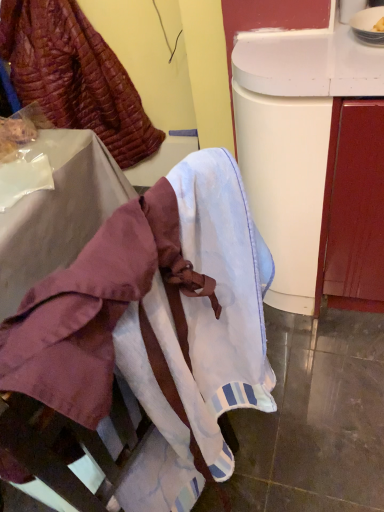
The image size is (384, 512). What do you see at coordinates (75, 76) in the screenshot?
I see `velvet-like burgundy fabric at upper left` at bounding box center [75, 76].

Find the location of a particular element. This screenshot has height=512, width=384. velvet-like burgundy fabric at upper left is located at coordinates (75, 76).

Measure the distance between velvet-like burgundy fabric at upper left and camera.

The distance of velvet-like burgundy fabric at upper left from camera is 5.47 feet.

This screenshot has width=384, height=512. Describe the element at coordinates (157, 319) in the screenshot. I see `white cotton towel at lower center` at that location.

Locate an element on the screen. Image resolution: width=384 pixels, height=512 pixels. white cotton towel at lower center is located at coordinates (157, 319).

What is the approximate width of white cotton towel at lower center?

The width of white cotton towel at lower center is 10.42 inches.

The height and width of the screenshot is (512, 384). What are the coordinates of `velvet-like burgundy fabric at upper left` in the screenshot? It's located at (75, 76).

Is velvet-like burgundy fabric at upper left to the right of white cotton towel at lower center from the viewer's perspective?

No.

Is velvet-like burgundy fabric at upper left in front of or behind white cotton towel at lower center in the image?

Visually, velvet-like burgundy fabric at upper left is located behind white cotton towel at lower center.

Which is nearer, (148, 125) or (236, 310)?

Point (148, 125).

From the image's perspective, who appears lower, velvet-like burgundy fabric at upper left or white cotton towel at lower center?

white cotton towel at lower center, from the image's perspective.

From a real-world perspective, is velvet-like burgundy fabric at upper left below white cotton towel at lower center?

Yes, from a real-world perspective, velvet-like burgundy fabric at upper left is under white cotton towel at lower center.

Between velvet-like burgundy fabric at upper left and white cotton towel at lower center, which one has smaller width?

white cotton towel at lower center.

Which of these two, velvet-like burgundy fabric at upper left or white cotton towel at lower center, stands taller?

velvet-like burgundy fabric at upper left is taller.

Which of these two, velvet-like burgundy fabric at upper left or white cotton towel at lower center, is smaller?

Smaller between the two is white cotton towel at lower center.

Is white cotton towel at lower center a part of velvet-like burgundy fabric at upper left?

No, white cotton towel at lower center is located outside of velvet-like burgundy fabric at upper left.

Are velvet-like burgundy fabric at upper left and white cotton towel at lower center located far from each other?

Yes.

Is velvet-like burgundy fabric at upper left facing away from white cotton towel at lower center?

No, velvet-like burgundy fabric at upper left is not facing away from white cotton towel at lower center.

How different are the orientations of velvet-like burgundy fabric at upper left and white cotton towel at lower center in degrees?

velvet-like burgundy fabric at upper left and white cotton towel at lower center are facing 102 degrees away from each other.

How distant is velvet-like burgundy fabric at upper left from white cotton towel at lower center?

The distance of velvet-like burgundy fabric at upper left from white cotton towel at lower center is 1.53 meters.

I want to click on leftover behind the white cotton towel at lower center, so click(x=75, y=76).

Which object is positioned more to the right, white cotton towel at lower center or velvet-like burgundy fabric at upper left?

From the viewer's perspective, white cotton towel at lower center appears more on the right side.

In the image, is white cotton towel at lower center positioned in front of or behind velvet-like burgundy fabric at upper left?

white cotton towel at lower center is in front of velvet-like burgundy fabric at upper left.

Considering the points (128, 497) and (30, 22), which point is behind, point (128, 497) or point (30, 22)?

Point (30, 22)

From the image's perspective, who appears lower, white cotton towel at lower center or velvet-like burgundy fabric at upper left?

white cotton towel at lower center appears lower in the image.

From a real-world perspective, between white cotton towel at lower center and velvet-like burgundy fabric at upper left, who is vertically lower?

From a 3D spatial view, velvet-like burgundy fabric at upper left is below.

Looking at their sizes, would you say white cotton towel at lower center is wider or thinner than velvet-like burgundy fabric at upper left?

In the image, white cotton towel at lower center appears to be more narrow than velvet-like burgundy fabric at upper left.

Can you confirm if white cotton towel at lower center is taller than velvet-like burgundy fabric at upper left?

Incorrect, the height of white cotton towel at lower center is not larger of that of velvet-like burgundy fabric at upper left.

Considering the relative sizes of white cotton towel at lower center and velvet-like burgundy fabric at upper left in the image provided, is white cotton towel at lower center bigger than velvet-like burgundy fabric at upper left?

No, white cotton towel at lower center is not bigger than velvet-like burgundy fabric at upper left.

Is white cotton towel at lower center surrounding velvet-like burgundy fabric at upper left?

No, white cotton towel at lower center does not contain velvet-like burgundy fabric at upper left.

Would you say white cotton towel at lower center is a long distance from velvet-like burgundy fabric at upper left?

Absolutely, white cotton towel at lower center is distant from velvet-like burgundy fabric at upper left.

Is white cotton towel at lower center facing towards velvet-like burgundy fabric at upper left?

No, white cotton towel at lower center is not facing towards velvet-like burgundy fabric at upper left.

Can you tell me how much white cotton towel at lower center and velvet-like burgundy fabric at upper left differ in facing direction?

The facing directions of white cotton towel at lower center and velvet-like burgundy fabric at upper left are 102 degrees apart.

This screenshot has width=384, height=512. What are the coordinates of `leftover that is above the white cotton towel at lower center (from the image's perspective)` in the screenshot? It's located at (75, 76).

Find the location of a particular element. The image size is (384, 512). leftover directly beneath the white cotton towel at lower center (from a real-world perspective) is located at coordinates (75, 76).

Identify the location of furniture below the velvet-like burgundy fabric at upper left (from the image's perspective). The width and height of the screenshot is (384, 512). (157, 319).